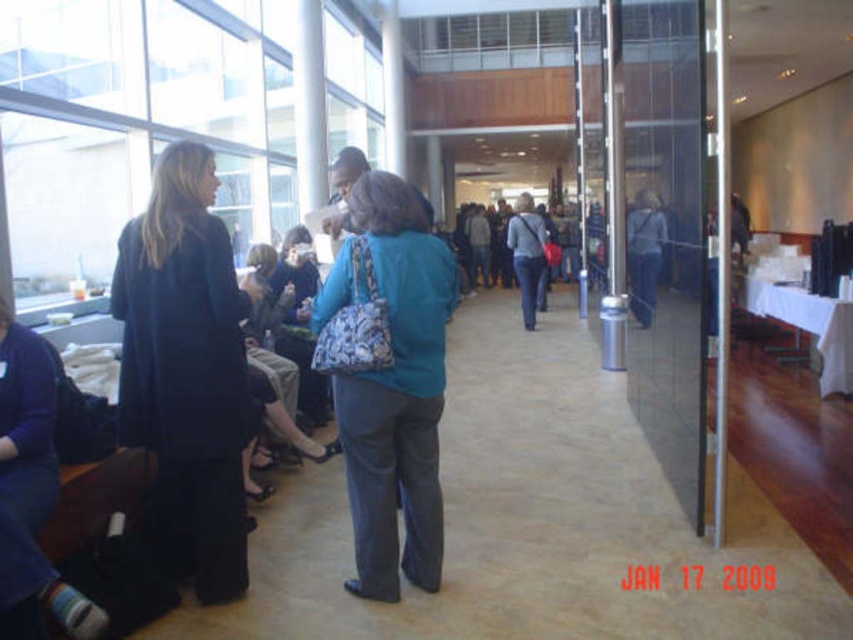
Can you confirm if dark blue fabric coat at left is wider than teal fabric purse at center?

No, dark blue fabric coat at left is not wider than teal fabric purse at center.

Is point (146, 348) closer to viewer compared to point (373, 264)?

No, (146, 348) is further to viewer.

Does point (200, 461) come closer to viewer compared to point (378, 195)?

No, it is behind (378, 195).

What are the coordinates of `dark blue fabric coat at left` in the screenshot? It's located at (186, 371).

Does blue fabric jacket at center have a smaller size compared to blue denim jeans at center?

Indeed, blue fabric jacket at center has a smaller size compared to blue denim jeans at center.

Is point (656, 227) positioned in front of point (534, 275)?

Yes, it is in front of point (534, 275).

The height and width of the screenshot is (640, 853). Find the location of `blue fabric jacket at center`. blue fabric jacket at center is located at coordinates (643, 253).

How far apart are teal fabric purse at center and blue fabric jacket at center?

The distance of teal fabric purse at center from blue fabric jacket at center is 7.40 feet.

Does teal fabric purse at center have a greater height compared to blue fabric jacket at center?

Yes.

Which is in front, point (416, 195) or point (653, 198)?

Point (416, 195)

Find the location of a particular element. This screenshot has height=640, width=853. teal fabric purse at center is located at coordinates pyautogui.click(x=397, y=396).